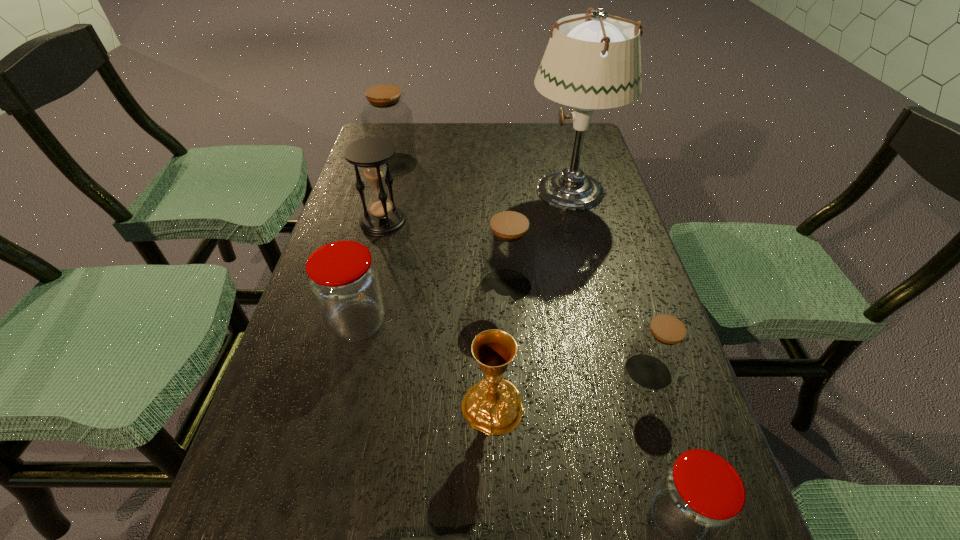
This screenshot has height=540, width=960. I want to click on the tallest object, so click(x=596, y=64).

Locate an element on the screen. the leftmost brown jar is located at coordinates (385, 115).

Where is `the biggest brown jar`? the biggest brown jar is located at coordinates (385, 115).

Find the location of a particular element. Image resolution: width=960 pixels, height=540 pixels. hourglass is located at coordinates (371, 154).

What are the coordinates of `the second farthest brown jar` in the screenshot? It's located at (507, 249).

Where is `the second brown jar from left to right`? This screenshot has width=960, height=540. the second brown jar from left to right is located at coordinates (507, 249).

The height and width of the screenshot is (540, 960). In order to click on the bigger red jar in this screenshot , I will do `click(343, 279)`.

The width and height of the screenshot is (960, 540). I want to click on the farther red jar, so (x=343, y=279).

Where is `chalice`? chalice is located at coordinates pyautogui.click(x=493, y=406).

At what (x,y) coordinates should I click in order to perform the action: click on the second nearest jar. Please return your answer as a coordinate pair (x, y). The height and width of the screenshot is (540, 960). Looking at the image, I should click on (659, 347).